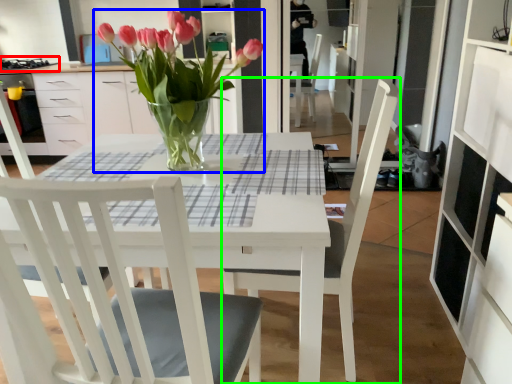
Question: Considering the real-world distances, which object is closest to gas stove (highlighted by a red box)? houseplant (highlighted by a blue box) or chair (highlighted by a green box).

Choices:
 (A) houseplant
 (B) chair

Answer: (A)